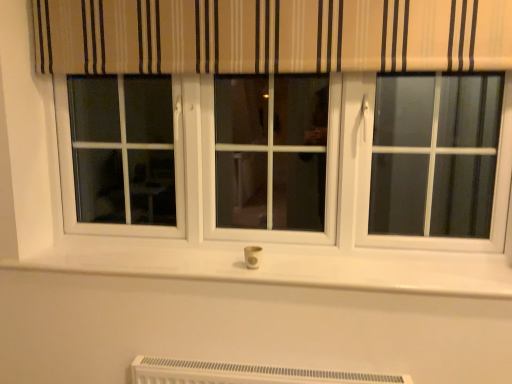
The image size is (512, 384). What do you see at coordinates (243, 373) in the screenshot?
I see `white plastic heater at lower center` at bounding box center [243, 373].

Where is `white plastic heater at lower center`? Image resolution: width=512 pixels, height=384 pixels. white plastic heater at lower center is located at coordinates (243, 373).

Find the location of a particular element. This screenshot has height=384, width=512. white plastic outlet at center is located at coordinates (252, 256).

What do you see at coordinates (252, 256) in the screenshot?
I see `white plastic outlet at center` at bounding box center [252, 256].

In order to face white plastic outlet at center, should I rotate leftwards or rightwards?

You should look left and rotate roughly 0.339 degrees.

Where is `white plastic heater at lower center`? The image size is (512, 384). white plastic heater at lower center is located at coordinates (243, 373).

Which object is positioned more to the right, white plastic heater at lower center or white plastic outlet at center?

white plastic heater at lower center.

Looking at this image, is the depth of white plastic heater at lower center less than that of white plastic outlet at center?

Yes, white plastic heater at lower center is closer to the viewer.

Which is behind, point (267, 376) or point (251, 257)?

Positioned behind is point (251, 257).

From the image's perspective, which is above, white plastic heater at lower center or white plastic outlet at center?

white plastic outlet at center appears higher in the image.

From a real-world perspective, between white plastic heater at lower center and white plastic outlet at center, who is vertically lower?

white plastic heater at lower center is physically lower.

Between white plastic heater at lower center and white plastic outlet at center, which one has smaller width?

With smaller width is white plastic outlet at center.

Is white plastic heater at lower center taller or shorter than white plastic outlet at center?

white plastic heater at lower center is taller than white plastic outlet at center.

Is white plastic heater at lower center bigger or smaller than white plastic outlet at center?

Clearly, white plastic heater at lower center is larger in size than white plastic outlet at center.

Is white plastic outlet at center completely or partially inside white plastic heater at lower center?

Definitely not — white plastic outlet at center is not inside white plastic heater at lower center.

Is white plastic heater at lower center not close to white plastic outlet at center?

white plastic heater at lower center is near white plastic outlet at center, not far away.

Is white plastic heater at lower center looking in the opposite direction of white plastic outlet at center?

No, white plastic heater at lower center's orientation is not away from white plastic outlet at center.

Can you tell me how much white plastic heater at lower center and white plastic outlet at center differ in facing direction?

0.00473 degrees.

Measure the distance between white plastic heater at lower center and white plastic outlet at center.

white plastic heater at lower center is 15.92 inches away from white plastic outlet at center.

You are a GUI agent. You are given a task and a screenshot of the screen. Output one action in this format:
    pyautogui.click(x=<x>, y=<y>)
    Task: Click on the electric outlet that is behind the white plastic heater at lower center
    This screenshot has width=512, height=384.
    Given the screenshot: What is the action you would take?
    pyautogui.click(x=252, y=256)

Which object is positioned more to the left, white plastic outlet at center or white plastic heater at lower center?

white plastic outlet at center.

Who is more distant, white plastic outlet at center or white plastic heater at lower center?

white plastic outlet at center is behind.

Which is nearer, (260,260) or (246,367)?

Positioned in front is point (246,367).

From the image's perspective, is white plastic outlet at center above or below white plastic heater at lower center?

white plastic outlet at center is situated higher than white plastic heater at lower center in the image.

From a real-world perspective, is white plastic outlet at center positioned above or below white plastic heater at lower center?

white plastic outlet at center is situated higher than white plastic heater at lower center in the real world.

Considering the sizes of white plastic outlet at center and white plastic heater at lower center in the image, is white plastic outlet at center wider or thinner than white plastic heater at lower center?

Considering their sizes, white plastic outlet at center looks slimmer than white plastic heater at lower center.

Considering the relative sizes of white plastic outlet at center and white plastic heater at lower center in the image provided, is white plastic outlet at center taller than white plastic heater at lower center?

No, white plastic outlet at center is not taller than white plastic heater at lower center.

Considering the relative sizes of white plastic outlet at center and white plastic heater at lower center in the image provided, is white plastic outlet at center smaller than white plastic heater at lower center?

Yes, white plastic outlet at center is smaller than white plastic heater at lower center.

Is white plastic heater at lower center a part of white plastic outlet at center?

No, white plastic outlet at center does not contain white plastic heater at lower center.

Would you consider white plastic outlet at center to be distant from white plastic heater at lower center?

No.

Is white plastic outlet at center oriented away from white plastic heater at lower center?

No.

How many degrees apart are the facing directions of white plastic outlet at center and white plastic heater at lower center?

0.00473 degrees.

Where is `electric outlet on the left of white plastic heater at lower center`? electric outlet on the left of white plastic heater at lower center is located at coordinates (252, 256).

What are the coordinates of `electric outlet above the white plastic heater at lower center (from a real-world perspective)` in the screenshot? It's located at pos(252,256).

Identify the location of heater below the white plastic outlet at center (from a real-world perspective). (243, 373).